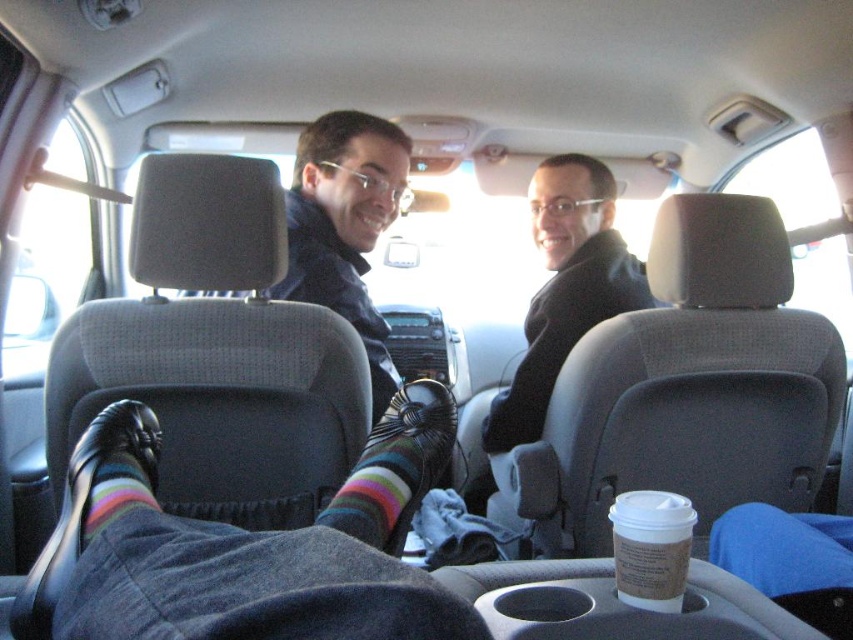
Which is more to the right, striped wool socks at center or matte black jacket at center?

From the viewer's perspective, striped wool socks at center appears more on the right side.

How distant is striped wool socks at center from matte black jacket at center?

striped wool socks at center and matte black jacket at center are 27.37 inches apart from each other.

Between point (86, 440) and point (308, 179), which one is positioned behind?

The point (308, 179) is more distant.

The width and height of the screenshot is (853, 640). In order to click on striped wool socks at center in this screenshot , I will do `click(242, 547)`.

Measure the distance between striped wool socks at center and striped wool sock at center.

striped wool socks at center is 4.62 inches away from striped wool sock at center.

Is striped wool socks at center further to camera compared to striped wool sock at center?

No, striped wool socks at center is in front of striped wool sock at center.

Who is more distant from viewer, (337,536) or (434,460)?

The point (434,460) is behind.

Find the location of `striped wool socks at center`. striped wool socks at center is located at coordinates (242, 547).

In the scene shown: Who is taller, striped wool sock at center or striped wool sock at lower left?

striped wool sock at center is taller.

Does striped wool sock at center lie in front of striped wool sock at lower left?

No.

The image size is (853, 640). What do you see at coordinates (395, 467) in the screenshot? I see `striped wool sock at center` at bounding box center [395, 467].

At what (x,y) coordinates should I click in order to perform the action: click on striped wool sock at center. Please return your answer as a coordinate pair (x, y). Image resolution: width=853 pixels, height=640 pixels. Looking at the image, I should click on (395, 467).